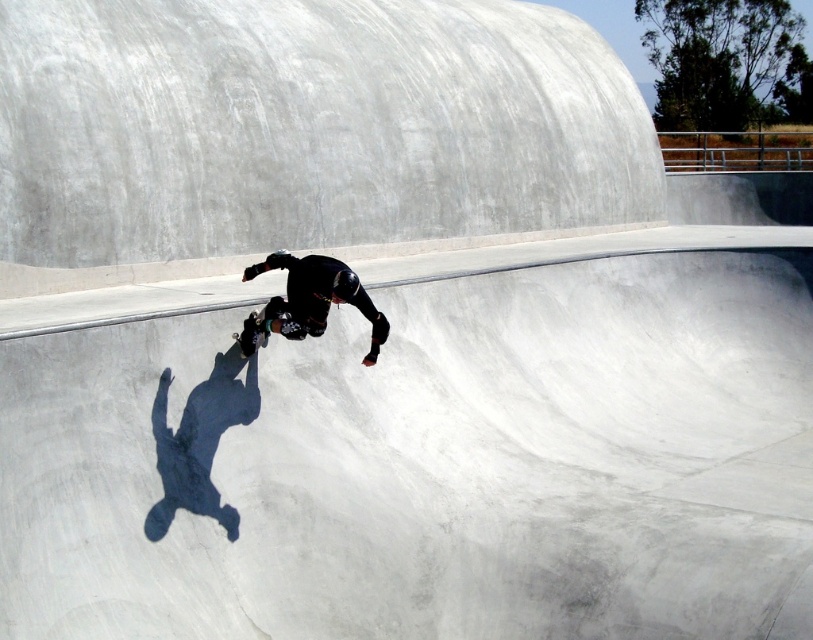
Which is more to the right, black matte skateboarder at center or black matte skateboard at center?

Positioned to the right is black matte skateboarder at center.

Is point (264, 330) more distant than point (259, 314)?

No, it is not.

Between point (379, 337) and point (250, 355), which one is positioned behind?

The point (250, 355) is more distant.

This screenshot has width=813, height=640. What are the coordinates of `black matte skateboarder at center` in the screenshot? It's located at (309, 300).